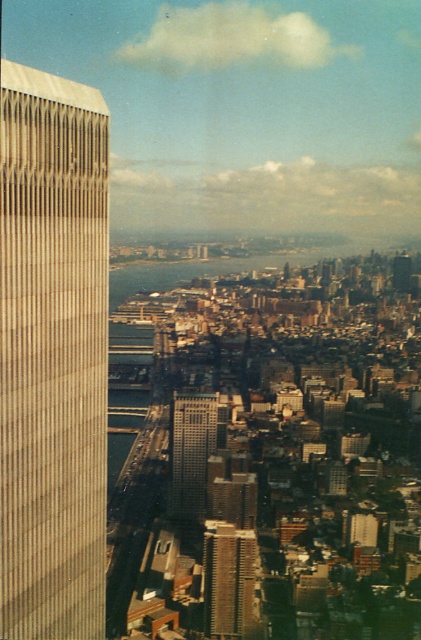
Is beige textured building at left positioned at the back of gray concrete building at center?

→ No, it is not.

Describe the element at coordinates (53, 355) in the screenshot. I see `beige textured building at left` at that location.

This screenshot has width=421, height=640. Find the location of `beige textured building at left`. beige textured building at left is located at coordinates (53, 355).

Can you confirm if beige textured building at left is positioned below silver glass skyscraper at center?

No.

Is beige textured building at left closer to camera compared to silver glass skyscraper at center?

Yes.

Which is behind, point (0, 97) or point (204, 440)?

The point (204, 440) is behind.

You are a GUI agent. You are given a task and a screenshot of the screen. Output one action in this format:
    pyautogui.click(x=<x>, y=<y>)
    Task: Click on the beige textured building at left
    This screenshot has width=421, height=640.
    Given the screenshot: What is the action you would take?
    pyautogui.click(x=53, y=355)

What do you see at coordinates (228, 579) in the screenshot? I see `gray concrete building at center` at bounding box center [228, 579].

From the picture: Is the position of gray concrete building at center less distant than that of silver glass skyscraper at center?

That is False.

At what (x,y) coordinates should I click in order to perform the action: click on gray concrete building at center. Please return your answer as a coordinate pair (x, y). This screenshot has height=640, width=421. Looking at the image, I should click on (228, 579).